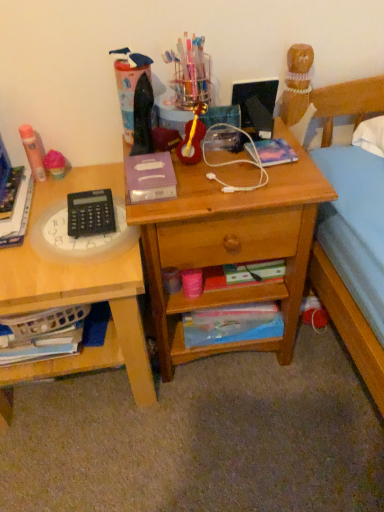
Find the location of a particular element. free space in front of white matte earphones at center is located at coordinates (232, 196).